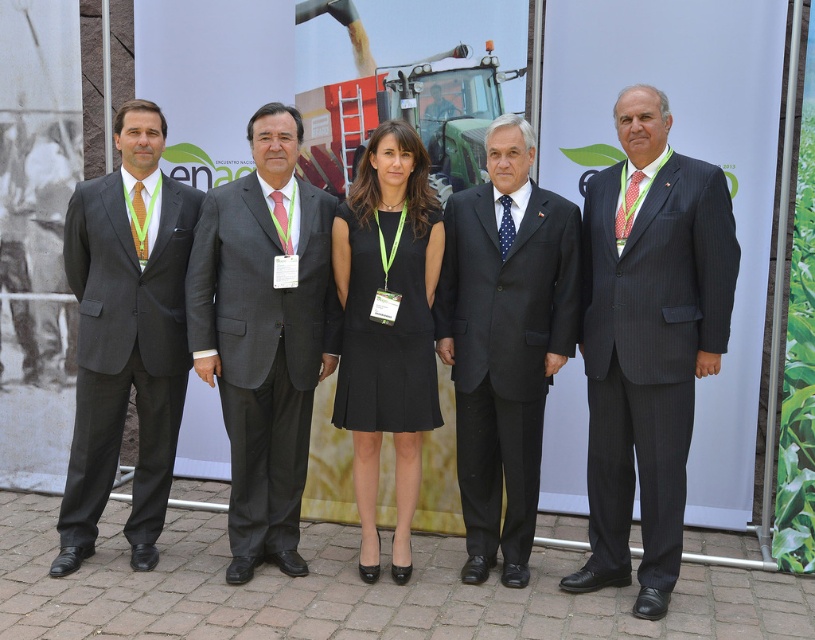
Question: Does matte black suit at left lie behind black fabric dress at center?

Choices:
 (A) yes
 (B) no

Answer: (A)

Question: Is dark gray suit at center closer to camera compared to matte black suit at left?

Choices:
 (A) no
 (B) yes

Answer: (B)

Question: Which of the following is the closest to the observer?

Choices:
 (A) black pinstripe suit at center
 (B) black fabric dress at center
 (C) matte black suit at left
 (D) dark pinstripe suit at right

Answer: (D)

Question: Can you confirm if dark gray suit at center is positioned to the left of black pinstripe suit at center?

Choices:
 (A) yes
 (B) no

Answer: (A)

Question: Based on their relative distances, which object is farther from the dark gray suit at center?

Choices:
 (A) matte black suit at left
 (B) dark pinstripe suit at right
 (C) black pinstripe suit at center

Answer: (B)

Question: Which point appears farthest from the camera in this image?

Choices:
 (A) (285, 211)
 (B) (469, 349)
 (C) (650, 444)
 (D) (117, 186)

Answer: (B)